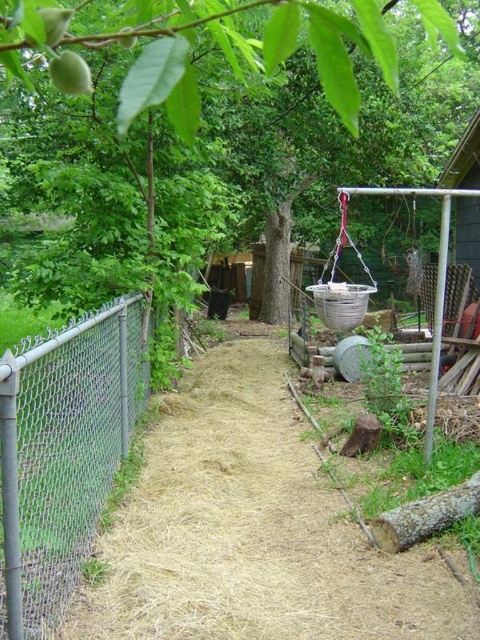
Is green matte apple at upper left closer to the viewer compared to green matte fruit at upper left?

That is True.

Is green matte apple at upper left positioned at the back of green matte fruit at upper left?

No, green matte apple at upper left is in front of green matte fruit at upper left.

Image resolution: width=480 pixels, height=640 pixels. Find the location of `green matte apple at upper left`. green matte apple at upper left is located at coordinates (54, 22).

Find the location of `green matte apple at upper left`. green matte apple at upper left is located at coordinates (54, 22).

Does silver chain-link fence at left have a greater width compared to green matte fruit at upper left?

Correct, the width of silver chain-link fence at left exceeds that of green matte fruit at upper left.

Does point (139, 388) come farther from viewer compared to point (134, 35)?

That is True.

What are the coordinates of `silver chain-link fence at left` in the screenshot? It's located at (63, 452).

Does silver chain-link fence at left appear on the left side of green matte peach at upper left?

Correct, you'll find silver chain-link fence at left to the left of green matte peach at upper left.

I want to click on silver chain-link fence at left, so click(63, 452).